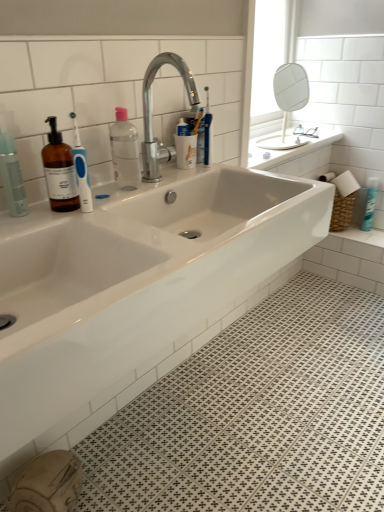
Where is `free location in front of matte black spray can at left, which appears as the 2th toiletry when viewed from the right`? The width and height of the screenshot is (384, 512). free location in front of matte black spray can at left, which appears as the 2th toiletry when viewed from the right is located at coordinates (21, 226).